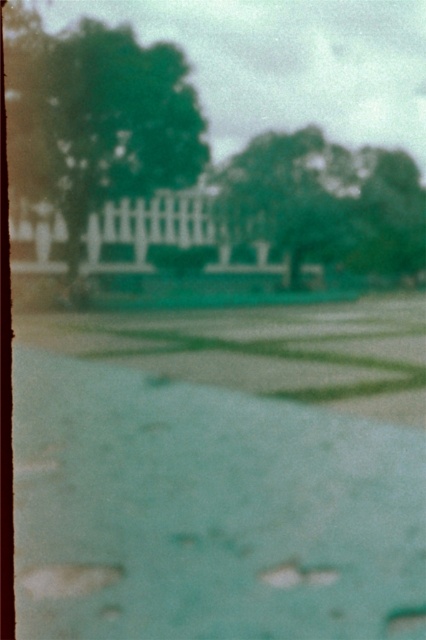
You are standing in the middle of the image and want to walk towards the green leafy tree at upper left. Which direction should you move relative to the green grass at center?

Since the green grass at center is to the right of the green leafy tree at upper left, you should move to the left to reach the tree from the center grass area.

You are a landscape architect planning to install a new sprinkler system in the garden. The sprinkler has a maximum range of 20 meters. Based on the image, will the sprinkler be able to water both the green grass at center and the green leafy tree at upper left?

The green grass at center and green leafy tree at upper left are 20.97 meters apart. Since the sprinkler has a maximum range of 20 meters, it cannot cover the distance between them, so it won

You are standing in the middle of the outdoor scene and looking towards the trees. Which green leafy tree is closer to the ground, the green leafy tree at upper left or the green leafy tree at upper center?

The green leafy tree at upper left is closer to the ground because it is positioned below the green leafy tree at upper center.